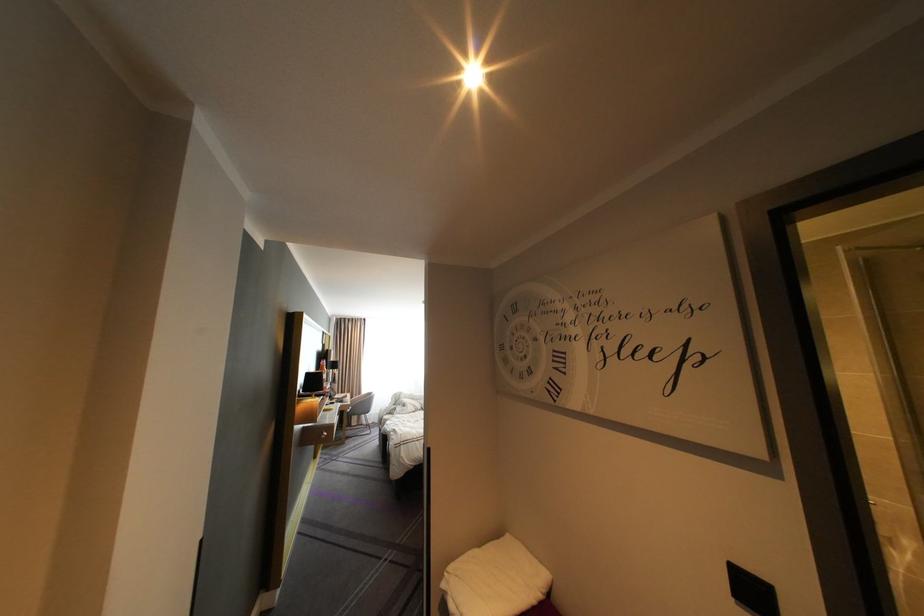
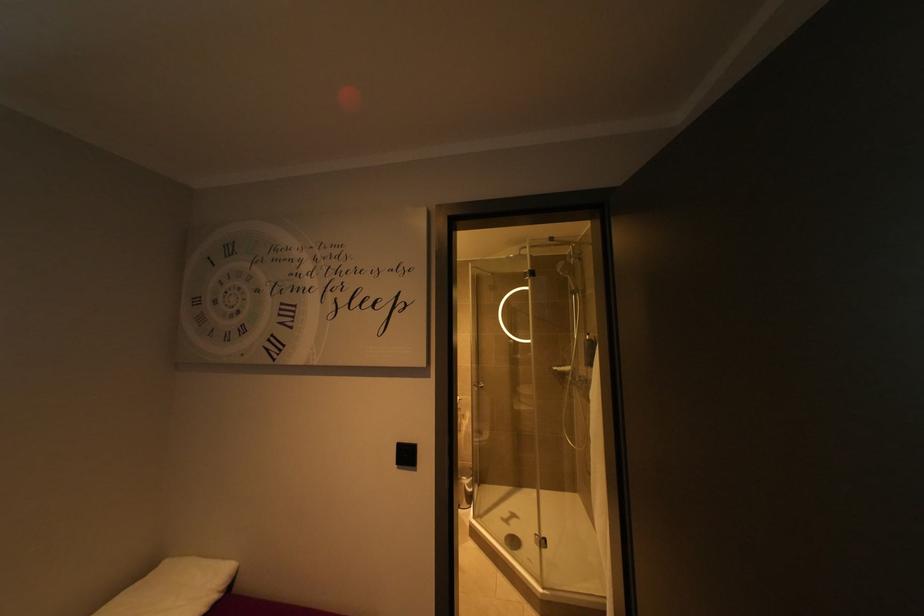
Question: The first image is from the beginning of the video and the second image is from the end. How did the camera likely rotate when shooting the video?

Choices:
 (A) Left
 (B) Right
 (C) Up
 (D) Down

Answer: (B)